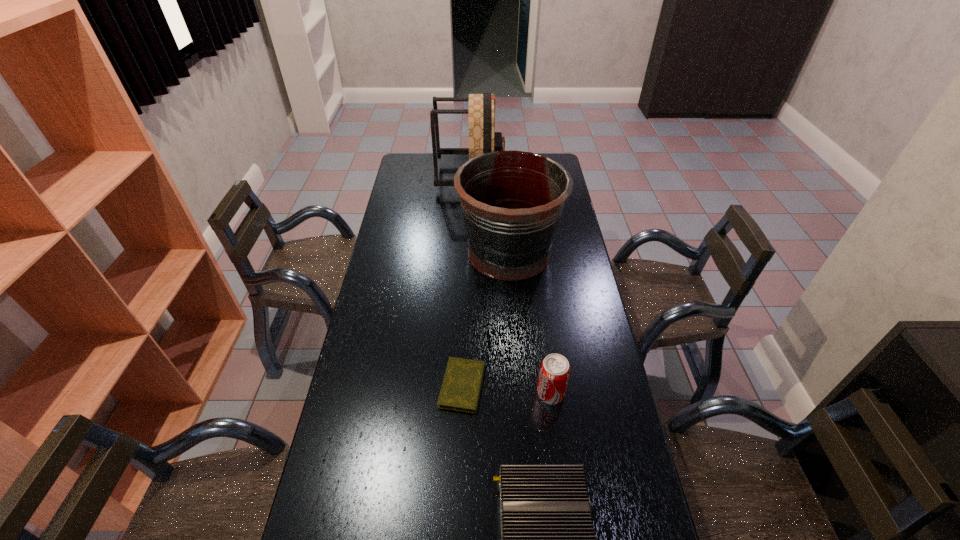
At what (x,y) coordinates should I click in order to perform the action: click on bucket that is at the right edge. Please return your answer as a coordinate pair (x, y). Looking at the image, I should click on (511, 201).

You are a GUI agent. You are given a task and a screenshot of the screen. Output one action in this format:
    pyautogui.click(x=<x>, y=<y>)
    Task: Click on the soda can that is at the right edge
    Image resolution: width=960 pixels, height=540 pixels.
    Given the screenshot: What is the action you would take?
    pyautogui.click(x=554, y=373)

Image resolution: width=960 pixels, height=540 pixels. Find the location of `vacant area at the far edge`. vacant area at the far edge is located at coordinates (461, 157).

You are a GUI agent. You are given a task and a screenshot of the screen. Output one action in this format:
    pyautogui.click(x=<x>, y=<y>)
    Task: Click on the vacant region at the left edge of the desktop
    
    Given the screenshot: What is the action you would take?
    pyautogui.click(x=415, y=202)

I want to click on free space at the right edge, so click(575, 407).

Locate an element on the screen. The height and width of the screenshot is (540, 960). free space between the soda can and the bucket is located at coordinates (530, 323).

The width and height of the screenshot is (960, 540). What are the coordinates of `free space between the diary and the bucket` in the screenshot? It's located at (486, 319).

Image resolution: width=960 pixels, height=540 pixels. What are the coordinates of `free area in between the farthest object and the soda can` in the screenshot? It's located at (511, 285).

Choose which object is the second nearest neighbor to the second farthest object. Please provide its 2D coordinates. Your answer should be formatted as a tuple, i.e. [(x, y)], where the tuple contains the x and y coordinates of a point satisfying the conditions above.

[(460, 391)]

I want to click on object that is the third closest to the farthest object, so click(x=554, y=373).